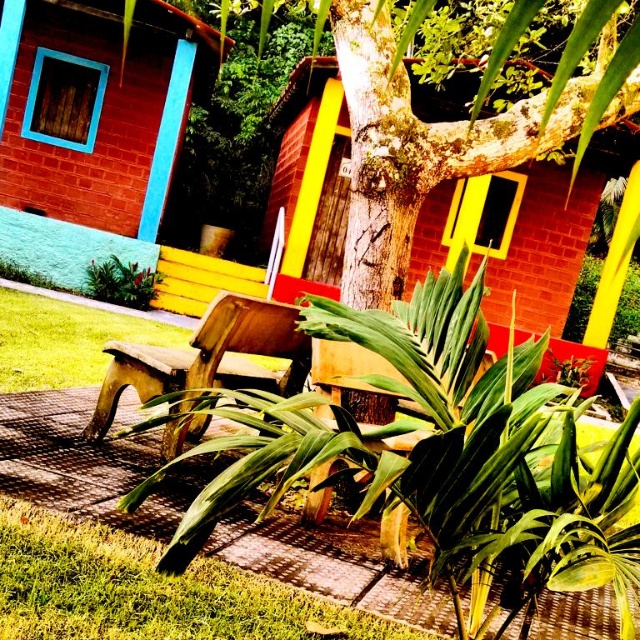
Question: Does wooden bench at center lie in front of green leafy plant at lower left?

Choices:
 (A) yes
 (B) no

Answer: (A)

Question: Among these points, which one is nearest to the camera?

Choices:
 (A) (113, 280)
 (B) (289, 268)

Answer: (A)

Question: Which object appears farthest from the camera in this image?

Choices:
 (A) wooden bench at center
 (B) green leafy plant at lower left
 (C) brick textured hut at center

Answer: (C)

Question: Does brick textured hut at center have a lesser width compared to wooden bench at center?

Choices:
 (A) no
 (B) yes

Answer: (B)

Question: Among these objects, which one is farthest from the camera?

Choices:
 (A) brick textured hut at center
 (B) brick wall at upper left
 (C) wooden bench at center

Answer: (A)

Question: Is brick wall at upper left thinner than wooden bench at center?

Choices:
 (A) yes
 (B) no

Answer: (B)